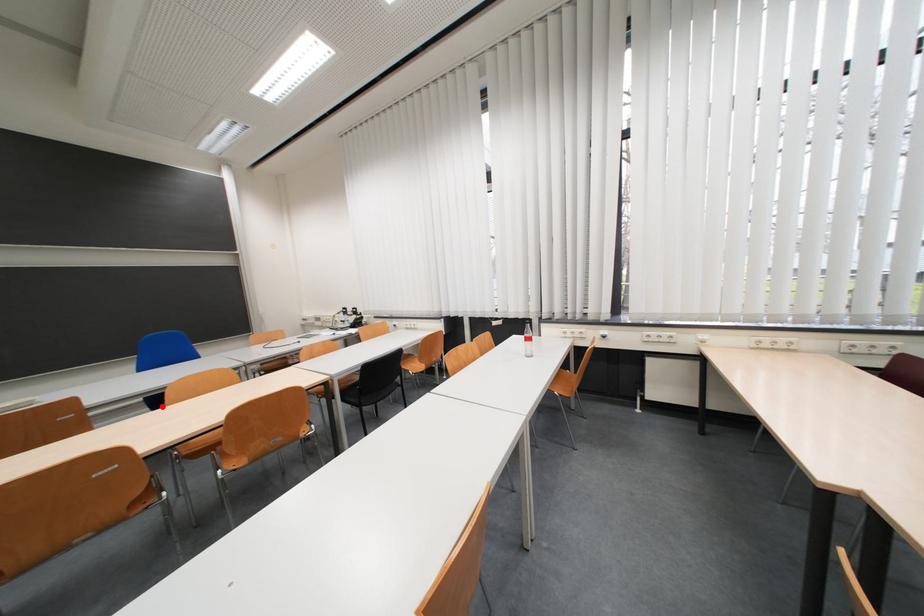
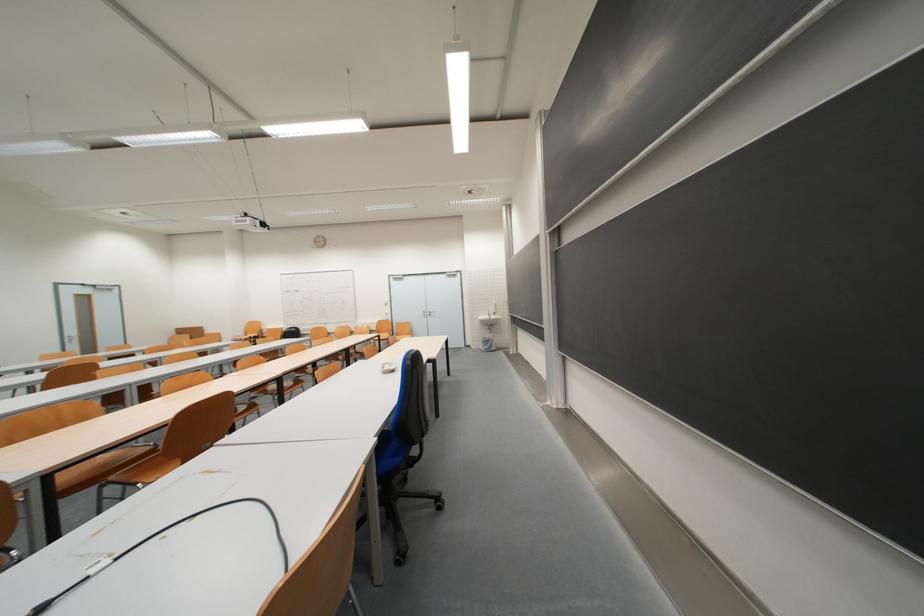
Question: I am providing you with two images of the same scene from different viewpoints. A red point is marked on the first image. Can you still see the location of the red point in image 2?

Choices:
 (A) Yes
 (B) No

Answer: (B)